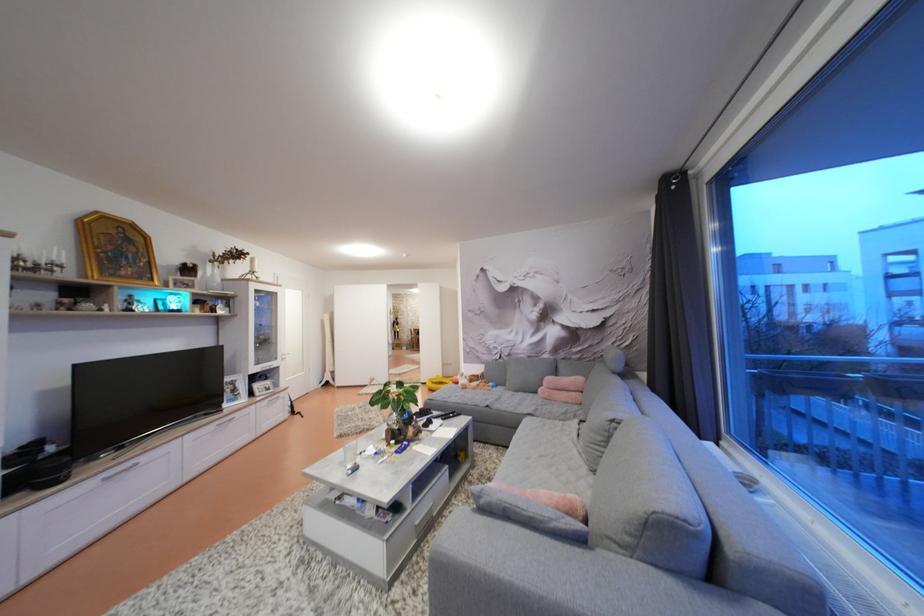
Where is `grey sofa armrest`? This screenshot has width=924, height=616. grey sofa armrest is located at coordinates pyautogui.click(x=556, y=578).